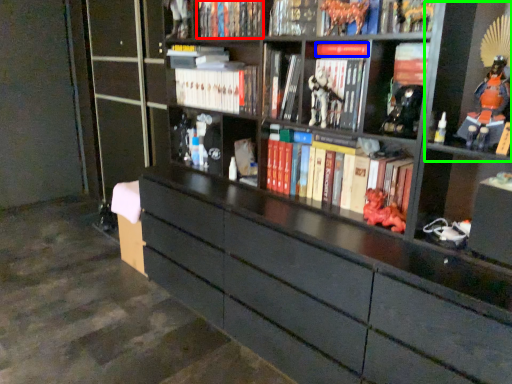
Question: Which object is the closest to the book (highlighted by a red box)? Choose among these: book (highlighted by a blue box) or cabinet (highlighted by a green box).

Choices:
 (A) book
 (B) cabinet

Answer: (A)